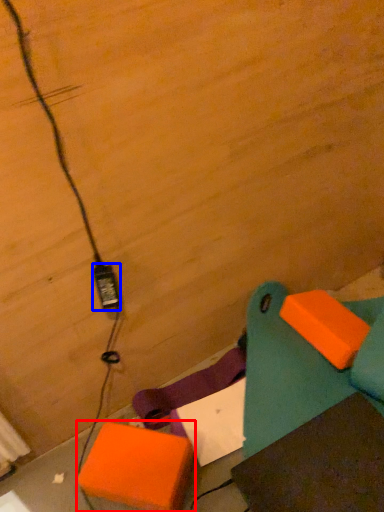
Question: Which object appears closest to the camera in this image, cardboard box (highlighted by a red box) or power plugs and sockets (highlighted by a blue box)?

Choices:
 (A) cardboard box
 (B) power plugs and sockets

Answer: (B)